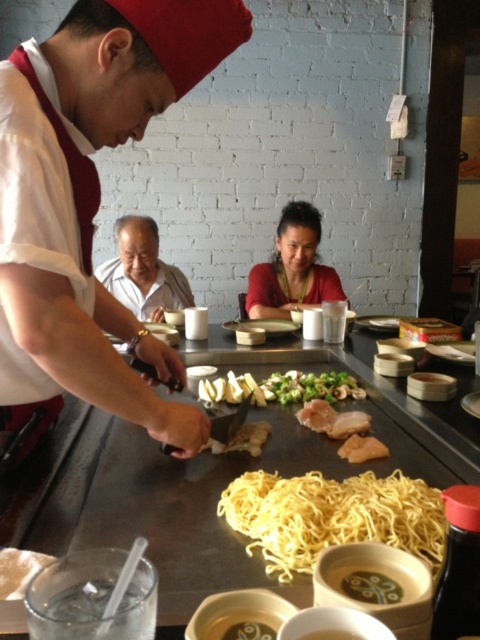
You are a chef who wants to stack ingredients on a plate. The green leafy vegetables at center and brown crispy chicken at center are available. Which one should you place at the bottom to ensure stability?

The green leafy vegetables at center should be placed at the bottom since they are taller than the brown crispy chicken at center, providing a stable base for the stack.

You are a customer at the teppanyaki restaurant and want to watch the chef prepare your meal. The chef is working on the yellow matte noodles at center. Where should you stand to see both the white shirt at center and the noodles clearly?

You should stand to the side or behind the white shirt at center so that you can see both the yellow matte noodles at center and the white shirt at center, since the noodles are positioned under the shirt, which might block the view if you are in front.

You are a customer at the teppanyaki restaurant and want to order the dish being prepared at the cooking surface. The chef mentions that the noodles are placed at the exact center of the cooking surface. If you look at the coordinate point (332,516) on the cooking surface, what would you expect to find there?

The point (332,516) corresponds to the yellow matte noodles at center, so you would find the yellow matte noodles at center there.